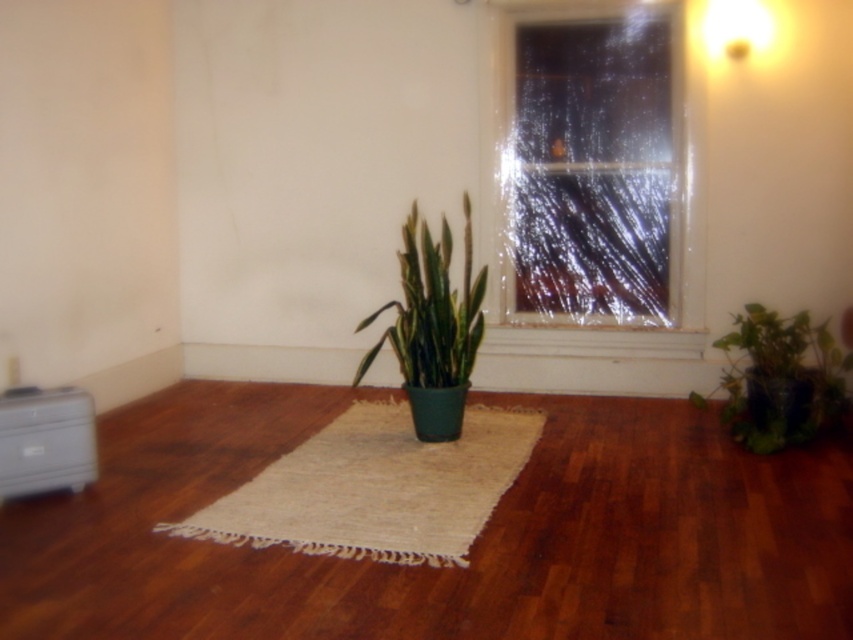
Question: Which of these objects is positioned closest to the white plastic drawer at lower left?

Choices:
 (A) brown wood floor at center
 (B) green matte plant at center
 (C) burlap rug at center
 (D) matte white lampshade at upper right

Answer: (A)

Question: Which object is farther from the camera taking this photo?

Choices:
 (A) white plastic drawer at lower left
 (B) transparent plastic window at upper center
 (C) green matte plant at center

Answer: (B)

Question: Does green matte plant at center appear under green matte plant at lower right?

Choices:
 (A) yes
 (B) no

Answer: (B)

Question: Which object is positioned closest to the green matte plant at lower right?

Choices:
 (A) burlap rug at center
 (B) white plastic drawer at lower left
 (C) brown wood floor at center
 (D) transparent plastic window at upper center

Answer: (C)

Question: Is brown wood floor at center positioned behind burlap rug at center?

Choices:
 (A) yes
 (B) no

Answer: (B)

Question: Can you confirm if brown wood floor at center is thinner than burlap rug at center?

Choices:
 (A) yes
 (B) no

Answer: (B)